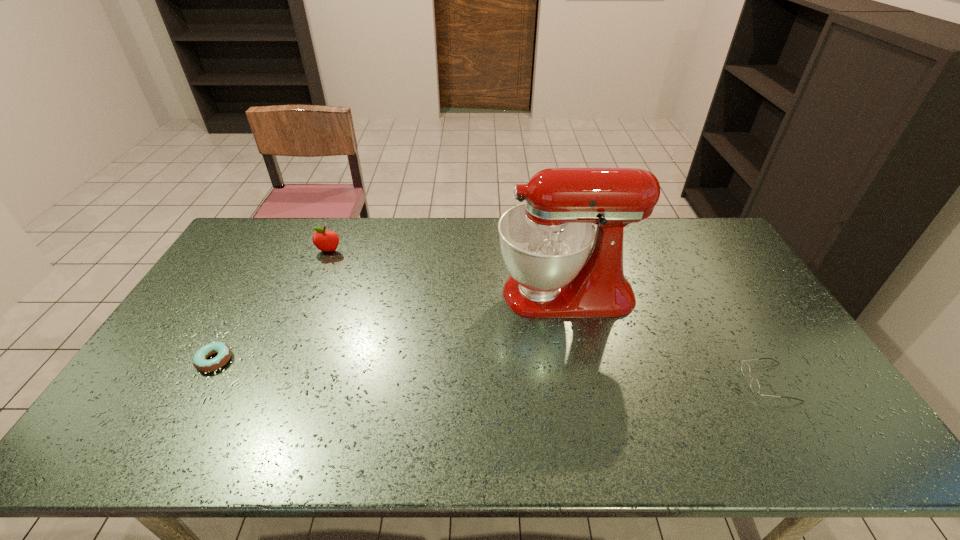
The image size is (960, 540). I want to click on vacant region between the second object from left to right and the second farthest object, so click(447, 272).

Where is `vacant area between the spectacles and the shortest object`? Image resolution: width=960 pixels, height=540 pixels. vacant area between the spectacles and the shortest object is located at coordinates (492, 372).

Find the location of a particular element. The height and width of the screenshot is (540, 960). free space between the mixer and the leftmost object is located at coordinates (390, 327).

Select which object is the second closest to the spectacles. Please provide its 2D coordinates. Your answer should be formatted as a tuple, i.e. [(x, y)], where the tuple contains the x and y coordinates of a point satisfying the conditions above.

[(326, 241)]

This screenshot has width=960, height=540. What are the coordinates of `object that ranks as the second closest to the apple` in the screenshot? It's located at (545, 242).

Locate an element on the screen. This screenshot has height=540, width=960. free space that satisfies the following two spatial constraints: 1. on the back side of the doughnut; 2. on the left side of the apple is located at coordinates (276, 251).